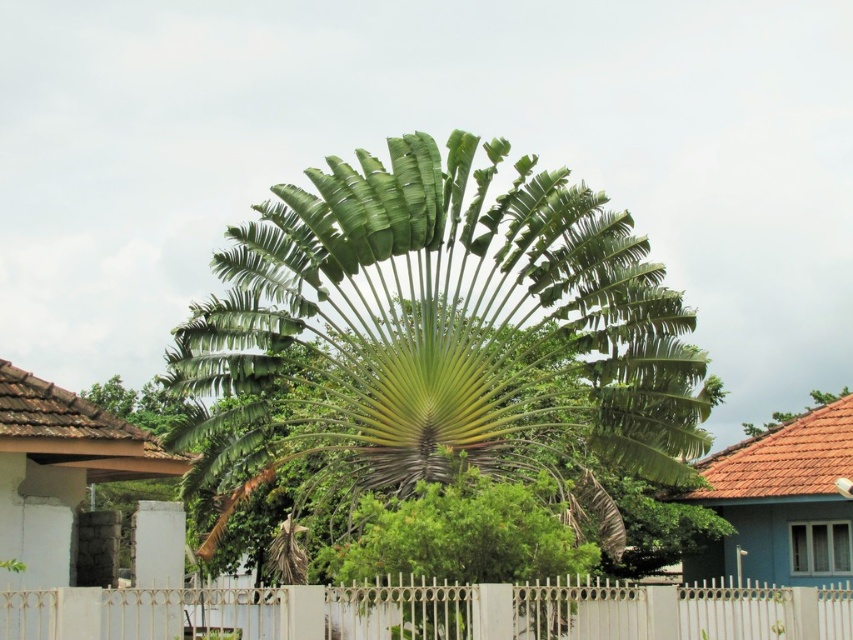
Question: In this image, where is green leafy palm at center located relative to white metal fence at center?

Choices:
 (A) right
 (B) left

Answer: (B)

Question: Which of the following is the closest to the observer?

Choices:
 (A) (271, 403)
 (B) (114, 632)

Answer: (B)

Question: Can you confirm if green leafy palm at center is positioned above white metal fence at center?

Choices:
 (A) yes
 (B) no

Answer: (A)

Question: Does green leafy palm at center have a lesser width compared to white metal fence at center?

Choices:
 (A) no
 (B) yes

Answer: (A)